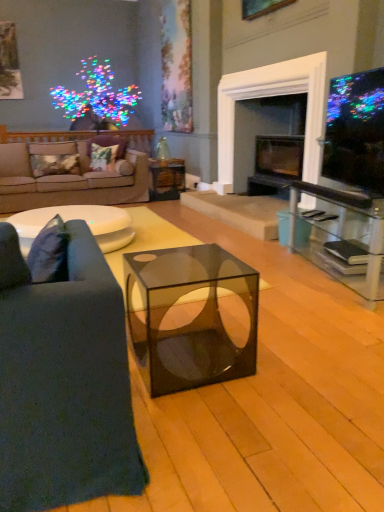
The height and width of the screenshot is (512, 384). Identify the location of free spot in front of transparent glass cube at center. (212, 423).